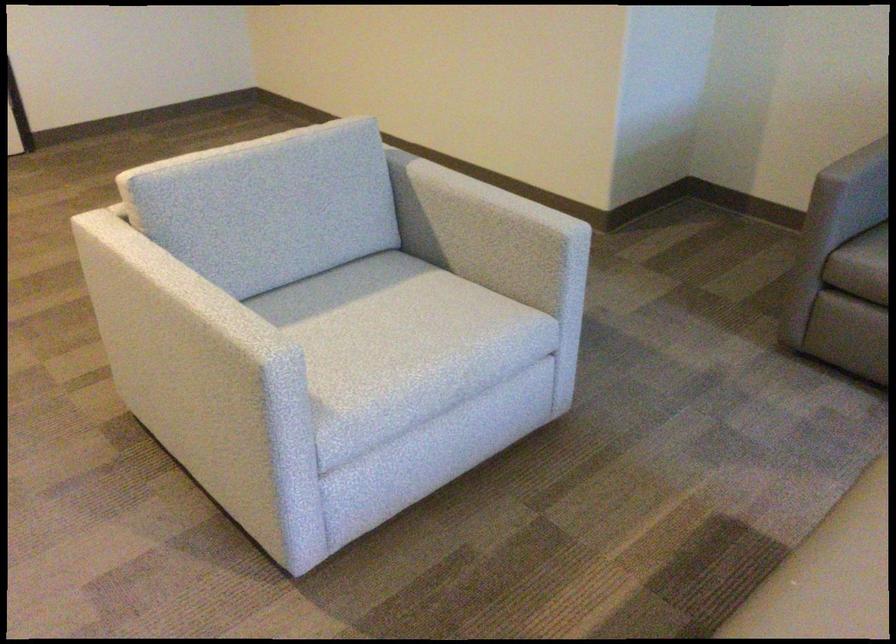
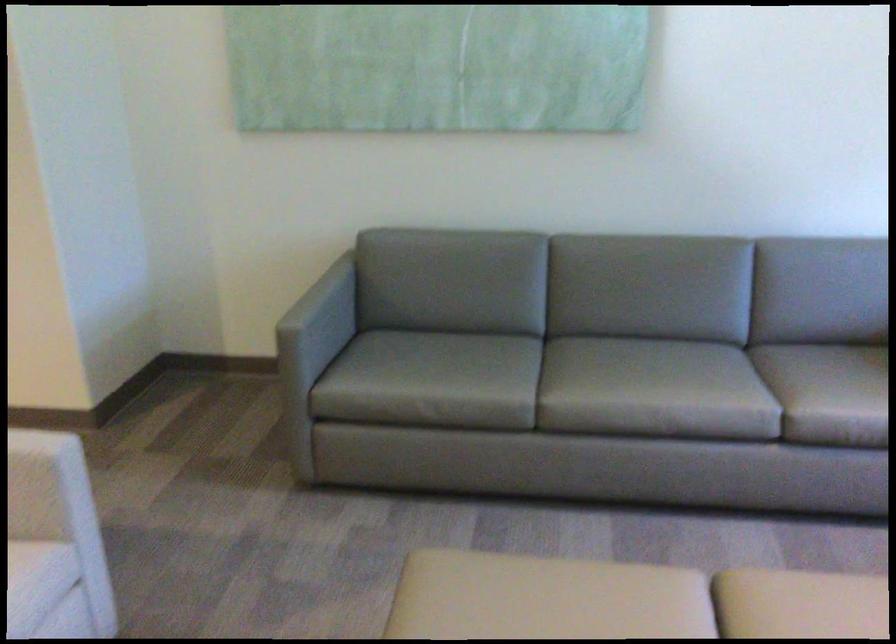
The point at (556, 305) is marked in the first image. Where is the corresponding point in the second image?

(55, 542)